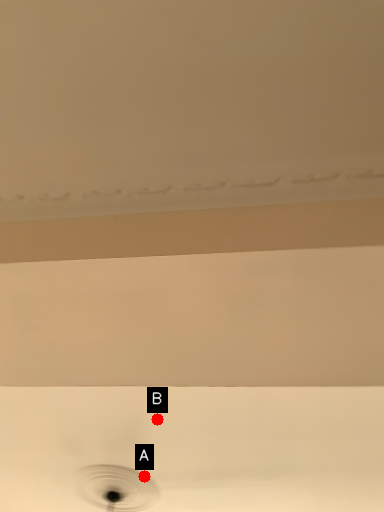
Question: Two points are circled on the image, labeled by A and B beside each circle. Which point is farther to the camera?

Choices:
 (A) A is further
 (B) B is further

Answer: (A)